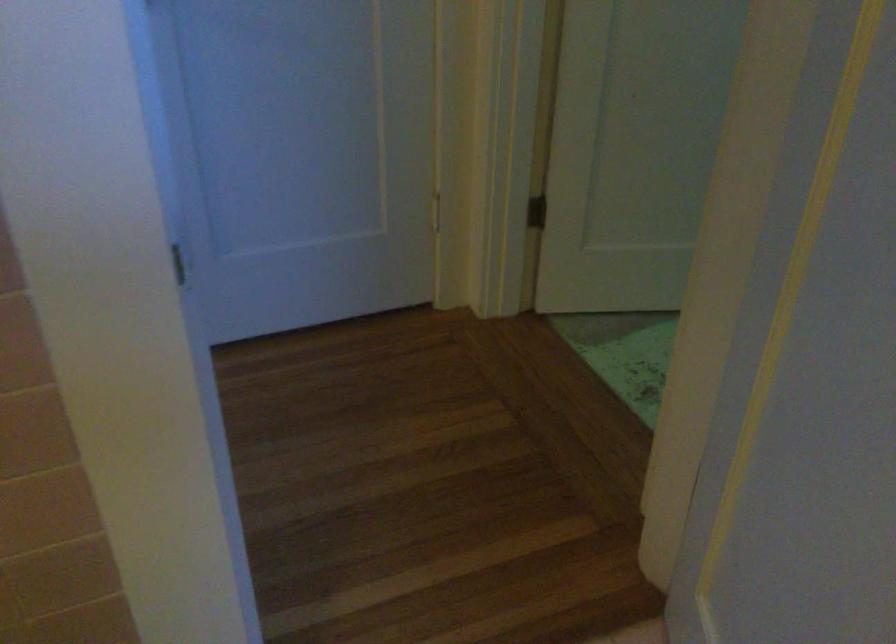
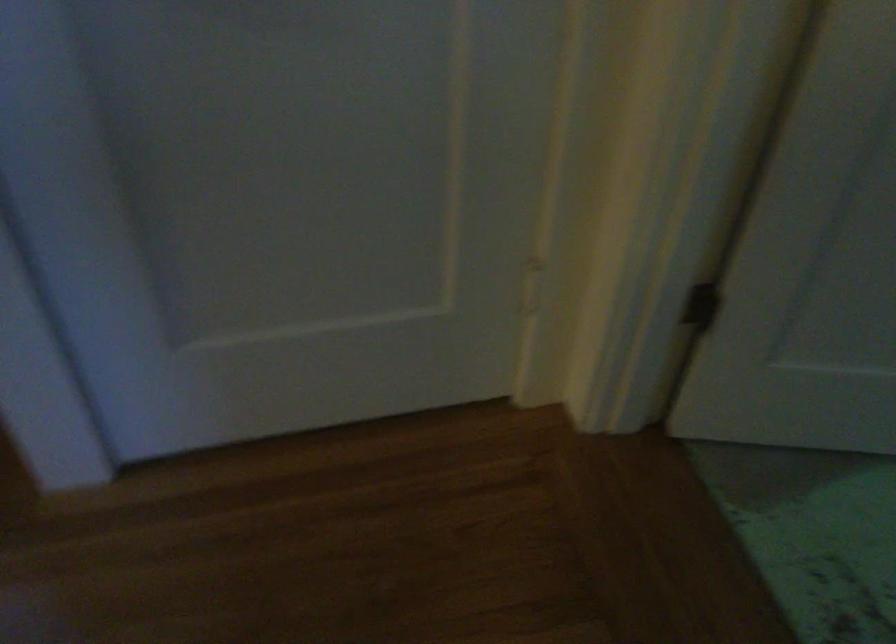
Question: Which direction would the cameraman need to move to produce the second image? Reply with the corresponding letter.

Choices:
 (A) Left
 (B) Right
 (C) Forward
 (D) Backward

Answer: (C)